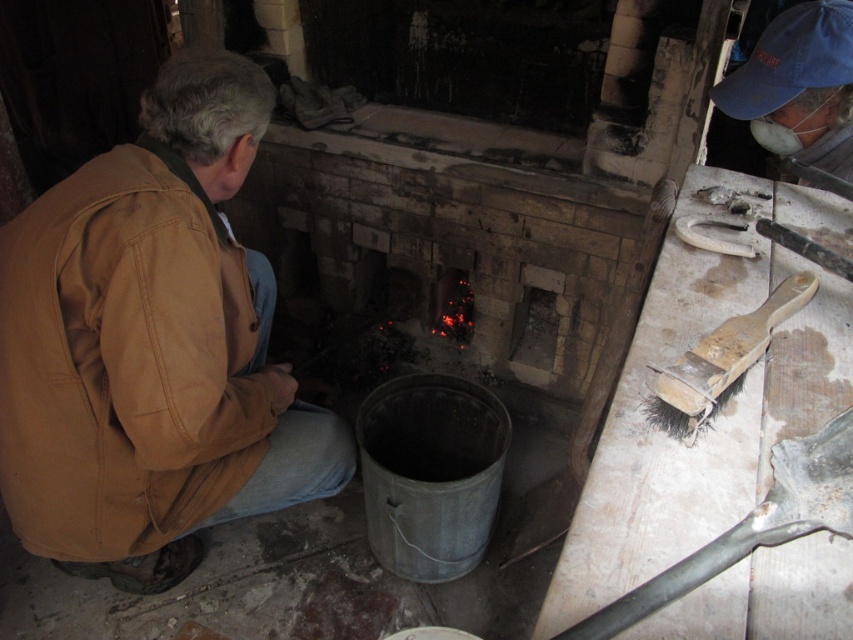
Question: Which point is closer to the camera?

Choices:
 (A) (799, 145)
 (B) (158, 364)

Answer: (B)

Question: Which point is farther to the camera?

Choices:
 (A) (175, 156)
 (B) (801, 109)
 (C) (770, 300)

Answer: (B)

Question: Considering the relative positions of blue fabric cap at upper right and wooden-bristled brush at right in the image provided, where is blue fabric cap at upper right located with respect to wooden-bristled brush at right?

Choices:
 (A) below
 (B) above

Answer: (B)

Question: Is brown cotton jacket at lower left below blue fabric cap at upper right?

Choices:
 (A) yes
 (B) no

Answer: (A)

Question: From the image, what is the correct spatial relationship of brown cotton jacket at lower left in relation to blue fabric cap at upper right?

Choices:
 (A) below
 (B) above

Answer: (A)

Question: Which point appears farthest from the camera in this image?

Choices:
 (A) (93, 520)
 (B) (746, 80)

Answer: (B)